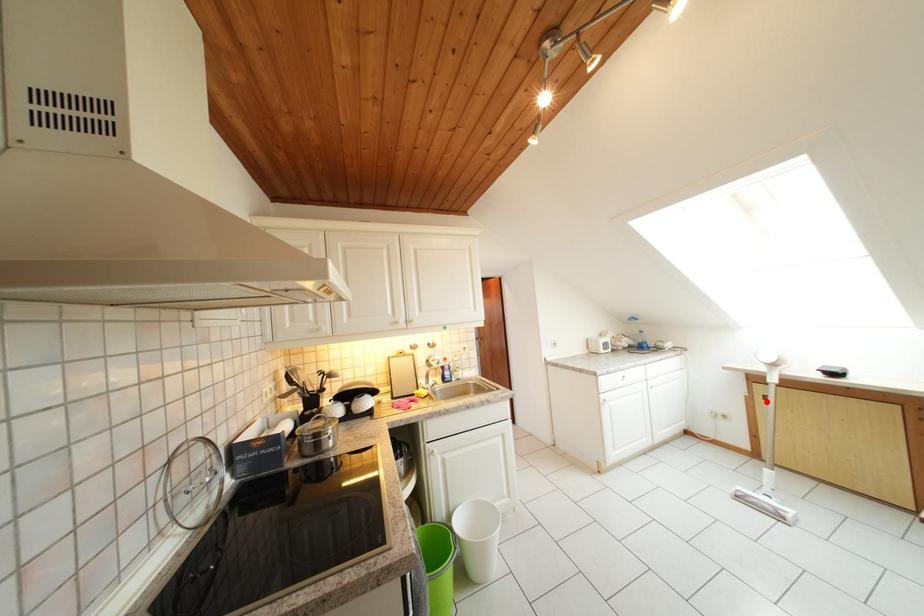
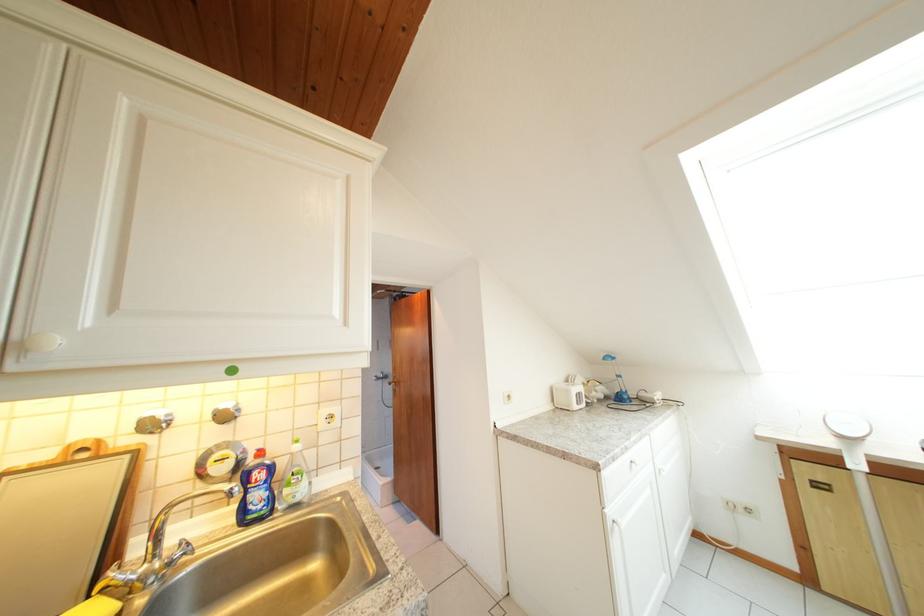
Question: A red point is marked in image1. In image2, is the corresponding 3D point closer to the camera or farther? Reply with the corresponding letter.

Choices:
 (A) The corresponding 3D point is closer.
 (B) The corresponding 3D point is farther.

Answer: (A)